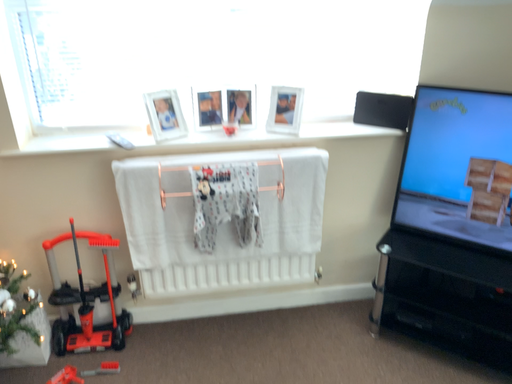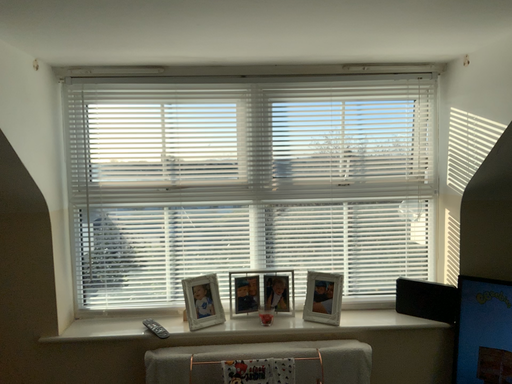
Question: Which way did the camera rotate in the video?

Choices:
 (A) rotated upward
 (B) rotated downward

Answer: (A)